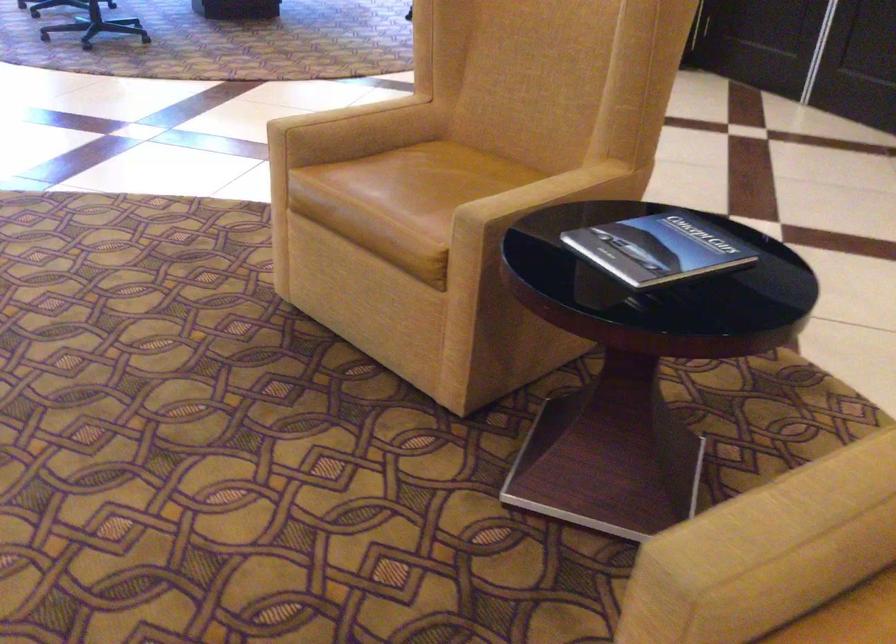
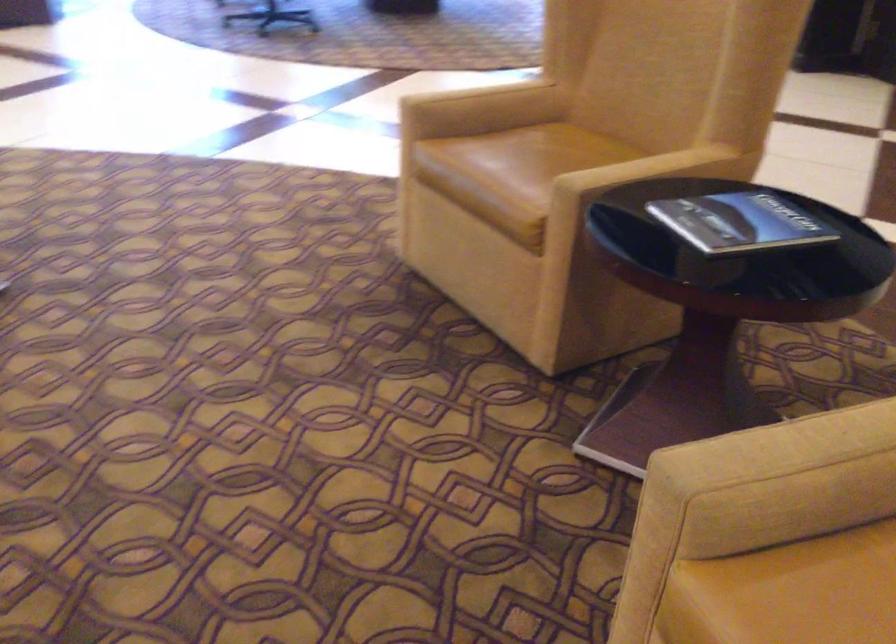
Question: The camera is either moving clockwise (left) or counter-clockwise (right) around the object. The first image is from the beginning of the video and the second image is from the end. Is the camera moving left or right when shooting the video?

Choices:
 (A) Left
 (B) Right

Answer: (B)